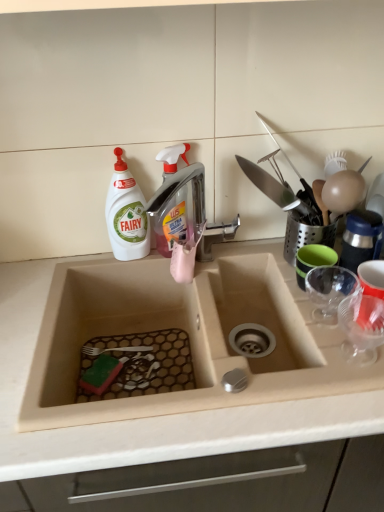
Question: Does transparent plastic cup at right, the 2th tableware positioned from the back, have a greater width compared to green rubber cup at right, which appears as the first tableware when viewed from the back?

Choices:
 (A) no
 (B) yes

Answer: (B)

Question: Can you confirm if transparent plastic cup at right, the 2th tableware positioned from the back, is bigger than green rubber cup at right, which appears as the first tableware when viewed from the back?

Choices:
 (A) no
 (B) yes

Answer: (B)

Question: Is transparent plastic cup at right, placed as the 2th tableware when sorted from front to back, oriented towards green rubber cup at right, positioned as the 3th tableware in front-to-back order?

Choices:
 (A) yes
 (B) no

Answer: (B)

Question: Is transparent plastic cup at right, the 2th tableware positioned from the back, positioned before green rubber cup at right, positioned as the 3th tableware in front-to-back order?

Choices:
 (A) no
 (B) yes

Answer: (B)

Question: Is transparent plastic cup at right, placed as the 2th tableware when sorted from front to back, completely or partially outside of green rubber cup at right, which appears as the first tableware when viewed from the back?

Choices:
 (A) yes
 (B) no

Answer: (A)

Question: Looking at the image, does translucent plastic spray bottle at center, which is the 2th cleaning product in left-to-right order, seem bigger or smaller compared to transparent plastic cup at right, the 2th tableware positioned from the back?

Choices:
 (A) big
 (B) small

Answer: (B)

Question: In the image, is translucent plastic spray bottle at center, which is the 2th cleaning product in left-to-right order, on the left side or the right side of transparent plastic cup at right, placed as the 2th tableware when sorted from front to back?

Choices:
 (A) left
 (B) right

Answer: (A)

Question: From a real-world perspective, is translucent plastic spray bottle at center, which is counted as the first cleaning product, starting from the right, positioned above or below transparent plastic cup at right, the 2th tableware positioned from the back?

Choices:
 (A) below
 (B) above

Answer: (B)

Question: Does point (157, 243) appear closer or farther from the camera than point (382, 301)?

Choices:
 (A) closer
 (B) farther

Answer: (B)

Question: From a real-world perspective, relative to white matte bottle at upper left, marked as the second cleaning product in a right-to-left arrangement, is metallic silver faucet at upper center vertically above or below?

Choices:
 (A) above
 (B) below

Answer: (B)

Question: Is metallic silver faucet at upper center wider or thinner than white matte bottle at upper left, marked as the second cleaning product in a right-to-left arrangement?

Choices:
 (A) wide
 (B) thin

Answer: (A)

Question: Considering the positions of metallic silver faucet at upper center and white matte bottle at upper left, marked as the second cleaning product in a right-to-left arrangement, in the image, is metallic silver faucet at upper center taller or shorter than white matte bottle at upper left, marked as the second cleaning product in a right-to-left arrangement,?

Choices:
 (A) short
 (B) tall

Answer: (A)

Question: In the image, is metallic silver faucet at upper center on the left side or the right side of white matte bottle at upper left, the 1th cleaning product from the left?

Choices:
 (A) left
 (B) right

Answer: (B)

Question: Does point (377, 279) appear closer or farther from the camera than point (203, 221)?

Choices:
 (A) closer
 (B) farther

Answer: (A)

Question: Considering the positions of transparent plastic cup at right, the 2th tableware positioned from the back, and metallic silver faucet at upper center in the image, is transparent plastic cup at right, the 2th tableware positioned from the back, wider or thinner than metallic silver faucet at upper center?

Choices:
 (A) wide
 (B) thin

Answer: (B)